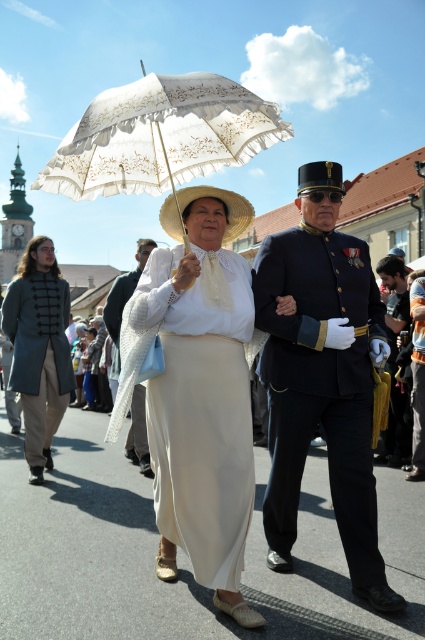
Does shiny dark blue uniform at center appear under white lace dress at center?

No, shiny dark blue uniform at center is not below white lace dress at center.

Who is lower down, shiny dark blue uniform at center or white lace dress at center?

white lace dress at center

Where is `shiny dark blue uniform at center`? shiny dark blue uniform at center is located at coordinates (323, 376).

Does white lace dress at center have a lesser height compared to matte white lace parasol at center?

No, white lace dress at center is not shorter than matte white lace parasol at center.

Is point (215, 397) less distant than point (147, 253)?

Yes.

Who is more distant from viewer, (209, 348) or (122, 289)?

Positioned behind is point (122, 289).

Locate an element on the screen. The image size is (425, 640). white lace dress at center is located at coordinates (203, 394).

Which is more to the right, white lace umbrella at center or matte white dress at center?

Positioned to the right is white lace umbrella at center.

Which of these two, white lace umbrella at center or matte white dress at center, stands shorter?

white lace umbrella at center is shorter.

The image size is (425, 640). Identify the location of white lace umbrella at center. (161, 136).